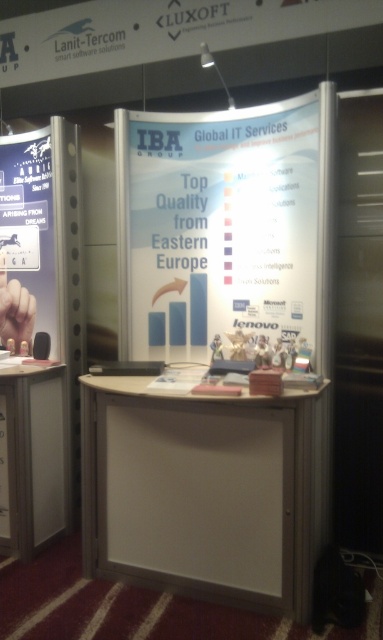
Between white paper at center and white plastic information desk at lower left, which one is positioned lower?

white plastic information desk at lower left is lower down.

Is white paper at center behind white plastic information desk at lower left?

No, it is in front of white plastic information desk at lower left.

Is point (289, 234) positioned in front of point (55, 400)?

That is True.

Identify the location of white paper at center. (217, 227).

Does white paper at center appear on the right side of brushed metal poster at left?

Correct, you'll find white paper at center to the right of brushed metal poster at left.

Between white paper at center and brushed metal poster at left, which one has less height?

brushed metal poster at left is shorter.

Is point (129, 193) farther from camera compared to point (37, 257)?

That is False.

Identify the location of white paper at center. (217, 227).

Is the position of white matte desk at center more distant than that of white plastic information desk at lower left?

No, white matte desk at center is closer to the viewer.

Which is below, white matte desk at center or white plastic information desk at lower left?

white matte desk at center is lower down.

Where is `white matte desk at center`? The height and width of the screenshot is (640, 383). white matte desk at center is located at coordinates (206, 492).